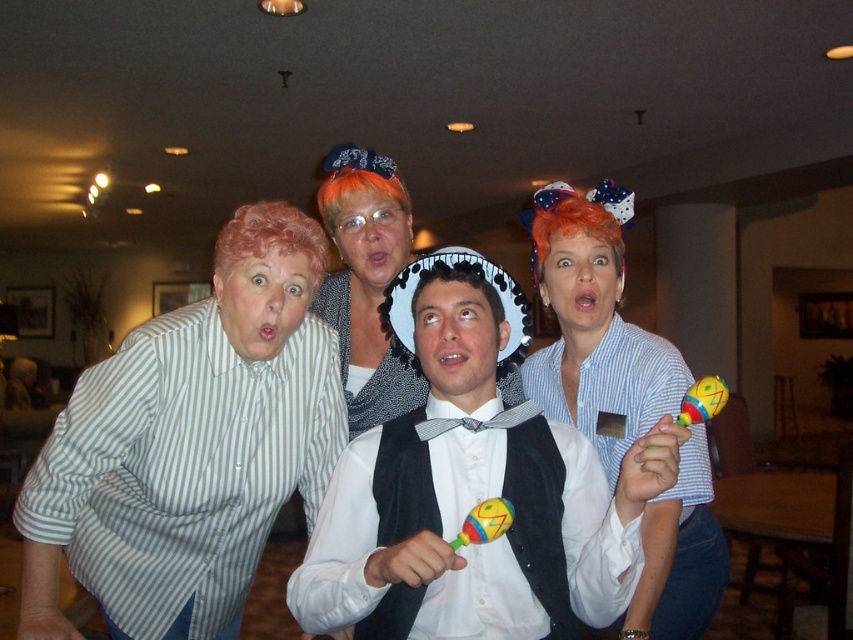
Question: Which of the following is the closest to the observer?

Choices:
 (A) black fabric wig at center
 (B) multicolored plastic maraca at center

Answer: (B)

Question: Can you confirm if white matte bow tie at center is thinner than curly blonde wig at left?

Choices:
 (A) no
 (B) yes

Answer: (A)

Question: Which point is closer to the camera?

Choices:
 (A) black fabric wig at center
 (B) curly blonde wig at left
 (C) orange synthetic wig at center

Answer: (A)

Question: Does blue striped shirt at upper right have a smaller size compared to gray scarf at center?

Choices:
 (A) no
 (B) yes

Answer: (A)

Question: From the image, what is the correct spatial relationship of multicolored plastic maraca at center in relation to multicolored plastic maraca at lower right?

Choices:
 (A) below
 (B) above

Answer: (A)

Question: Among these points, which one is farthest from the camera?

Choices:
 (A) (692, 396)
 (B) (532, 209)
 (C) (410, 276)

Answer: (B)